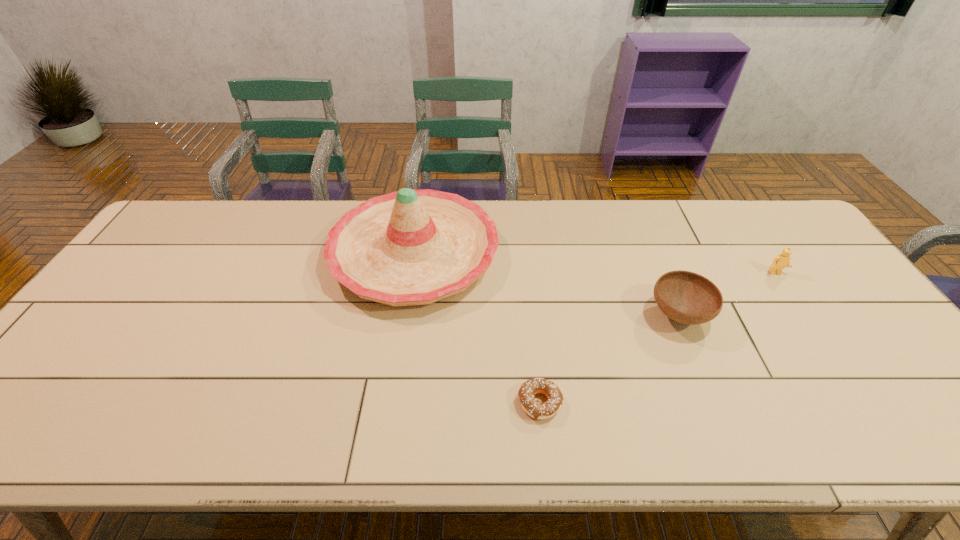
I want to click on vacant point located between the sombrero and the Lego, so click(595, 264).

The height and width of the screenshot is (540, 960). Identify the location of vacant area that lies between the third object from right to left and the tallest object. (477, 328).

This screenshot has height=540, width=960. Identify the location of empty space between the tallest object and the doughnut. (477, 328).

Where is `free point between the bowl and the third object from right to left`? The height and width of the screenshot is (540, 960). free point between the bowl and the third object from right to left is located at coordinates (610, 359).

The width and height of the screenshot is (960, 540). Find the location of `blank region between the bowl and the nearest object`. blank region between the bowl and the nearest object is located at coordinates (610, 359).

Identify the location of empty space that is in between the doughnut and the tallest object. The width and height of the screenshot is (960, 540). (477, 328).

At what (x,y) coordinates should I click in order to perform the action: click on free space between the Lego and the second object from left to right. Please return your answer as a coordinate pair (x, y). Looking at the image, I should click on (658, 338).

The image size is (960, 540). Find the location of `free space that is in between the rightmost object and the sombrero`. free space that is in between the rightmost object and the sombrero is located at coordinates (595, 264).

This screenshot has width=960, height=540. I want to click on blank region between the nearest object and the bowl, so click(610, 359).

Point out which object is positioned as the third nearest to the bowl. Please provide its 2D coordinates. Your answer should be formatted as a tuple, i.e. [(x, y)], where the tuple contains the x and y coordinates of a point satisfying the conditions above.

[(411, 247)]